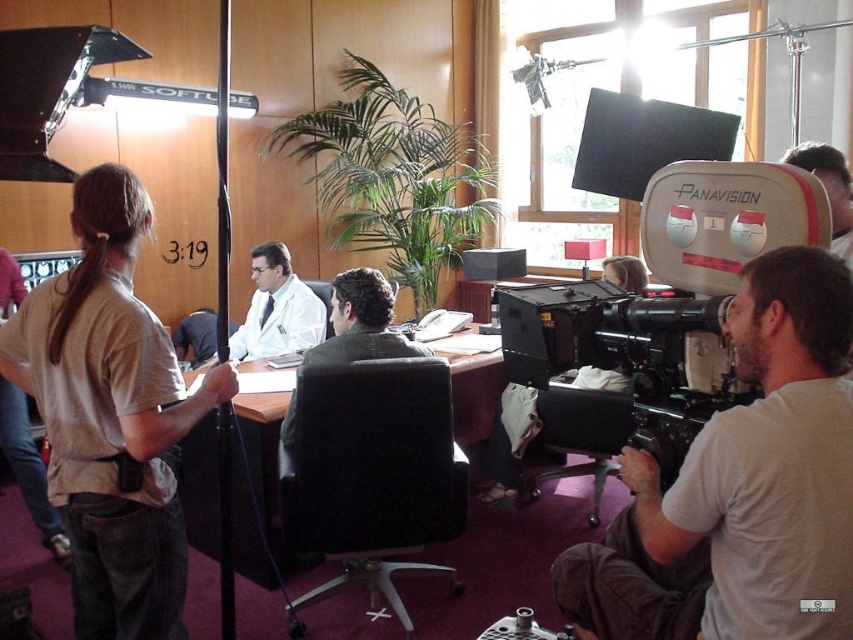
You are an actor standing at the center of the medical office. You need to move to the matte gray camera at right. What direction should you walk to reach it?

The matte gray camera at right is located at point (741, 486). Since you are at the center, moving towards the right side of the frame would lead you to the matte gray camera at right.

In the scene shown: You are an assistant director on set and need to adjust the lighting for the doctor wearing the white matte coat at center. Since the matte black panavision camera at right is in the way, can you move it closer to the doctor to make space for the lighting equipment? Explain why or why not.

The matte black panavision camera at right is already closer to the viewer than the white matte coat at center. Moving it closer to the doctor would bring it even closer to the viewer, potentially blocking the doctor from the camera lens. This would make it harder to capture the doctor in frame, so it is not advisable to move the camera closer.